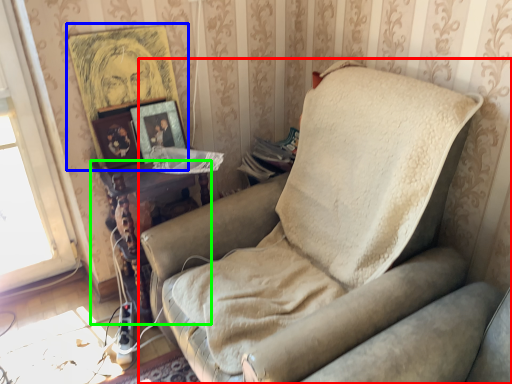
Question: Which object is the farthest from studio couch (highlighted by a red box)? Choose among these: picture frame (highlighted by a blue box) or table (highlighted by a green box).

Choices:
 (A) picture frame
 (B) table

Answer: (A)